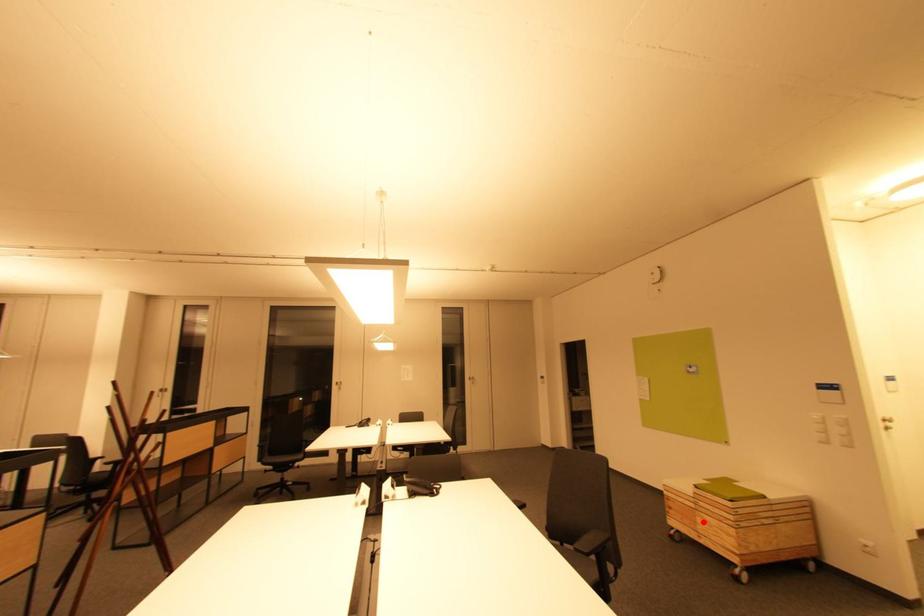
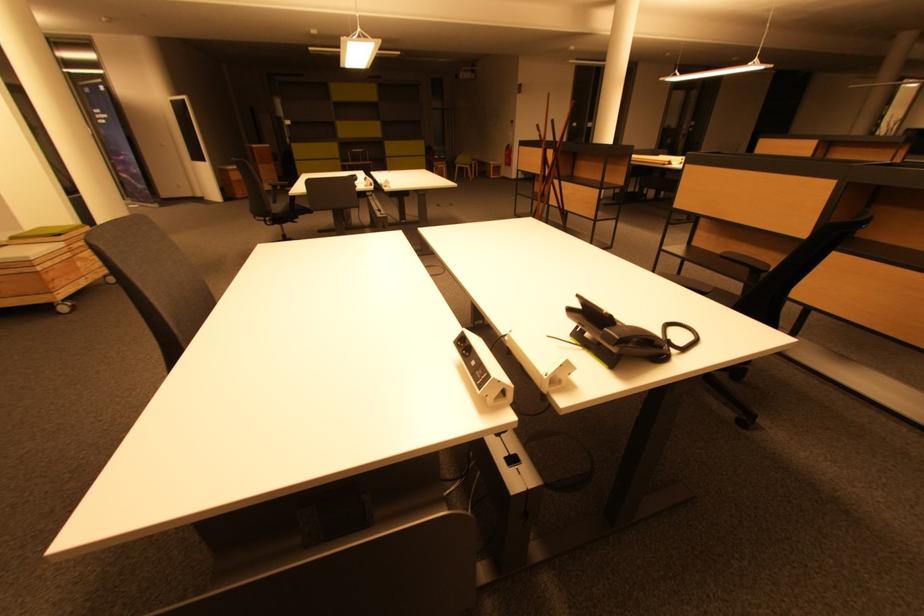
Question: I am providing you with two images of the same scene from different viewpoints. In image1, a red point is highlighted. Considering the same 3D point in image2, which of the following is correct?

Choices:
 (A) It is closer
 (B) It is farther

Answer: (B)